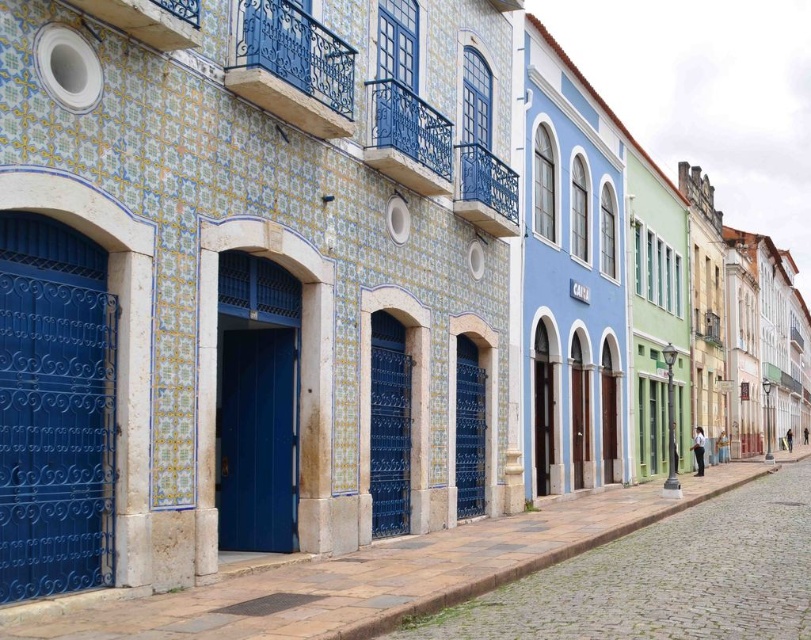
Question: Is matte blue gate at left smaller than matte blue gate at center?

Choices:
 (A) no
 (B) yes

Answer: (B)

Question: Which object appears closest to the camera in this image?

Choices:
 (A) matte blue gate at left
 (B) matte blue door at center
 (C) matte blue gate at center

Answer: (A)

Question: Among these points, which one is farthest from the camera?

Choices:
 (A) (264, 522)
 (B) (471, 499)
 (C) (71, 321)

Answer: (B)

Question: Among these points, which one is nearest to the camera?

Choices:
 (A) coord(35,397)
 (B) coord(228,460)
 (C) coord(457,515)

Answer: (A)

Question: Is matte blue door at center above matte blue gate at center?

Choices:
 (A) yes
 (B) no

Answer: (A)

Question: Is matte blue door at center thinner than matte blue gate at center?

Choices:
 (A) yes
 (B) no

Answer: (B)